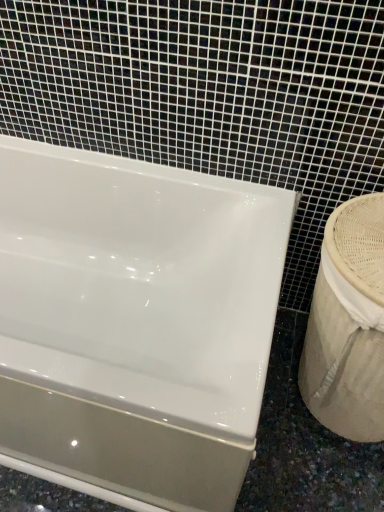
Question: Is white glossy sink at right at the back of glossy ceramic bathtub at upper left?

Choices:
 (A) yes
 (B) no

Answer: (B)

Question: From a real-world perspective, is glossy ceramic bathtub at upper left beneath white glossy sink at right?

Choices:
 (A) yes
 (B) no

Answer: (A)

Question: Is glossy ceramic bathtub at upper left bigger than white glossy sink at right?

Choices:
 (A) yes
 (B) no

Answer: (A)

Question: From a real-world perspective, is glossy ceramic bathtub at upper left physically above white glossy sink at right?

Choices:
 (A) yes
 (B) no

Answer: (B)

Question: Is glossy ceramic bathtub at upper left not near white glossy sink at right?

Choices:
 (A) yes
 (B) no

Answer: (B)

Question: Is white glossy sink at right located within glossy ceramic bathtub at upper left?

Choices:
 (A) no
 (B) yes

Answer: (A)

Question: Can you confirm if white glossy sink at right is wider than glossy ceramic bathtub at upper left?

Choices:
 (A) yes
 (B) no

Answer: (B)

Question: From a real-world perspective, is white glossy sink at right over glossy ceramic bathtub at upper left?

Choices:
 (A) yes
 (B) no

Answer: (A)

Question: From the image's perspective, does white glossy sink at right appear lower than glossy ceramic bathtub at upper left?

Choices:
 (A) no
 (B) yes

Answer: (B)

Question: From the image's perspective, is white glossy sink at right above glossy ceramic bathtub at upper left?

Choices:
 (A) yes
 (B) no

Answer: (B)

Question: From a real-world perspective, is white glossy sink at right beneath glossy ceramic bathtub at upper left?

Choices:
 (A) yes
 (B) no

Answer: (B)

Question: Does white glossy sink at right have a greater height compared to glossy ceramic bathtub at upper left?

Choices:
 (A) no
 (B) yes

Answer: (B)

Question: From the image's perspective, is white glossy sink at right positioned above or below glossy ceramic bathtub at upper left?

Choices:
 (A) below
 (B) above

Answer: (A)